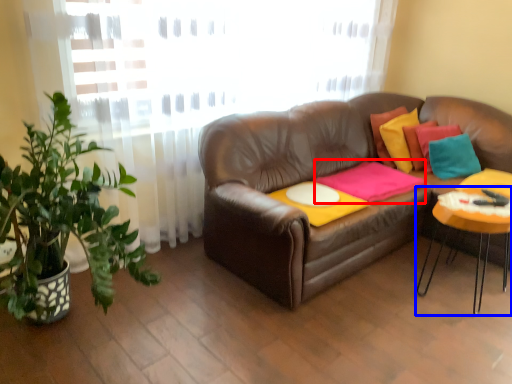
Question: Which object is closer to the camera taking this photo, blanket (highlighted by a red box) or table (highlighted by a blue box)?

Choices:
 (A) blanket
 (B) table

Answer: (B)